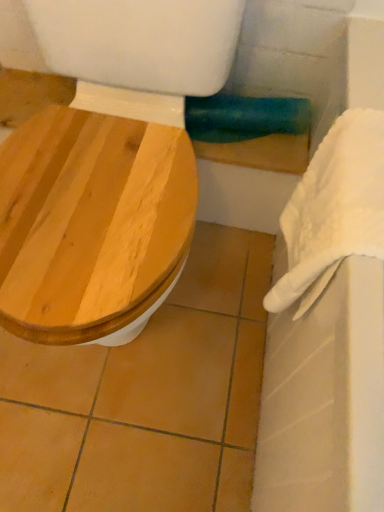
The height and width of the screenshot is (512, 384). Find the location of `vacant area on top of white fluffy towel at right (from a real-world perspective)`. vacant area on top of white fluffy towel at right (from a real-world perspective) is located at coordinates (360, 168).